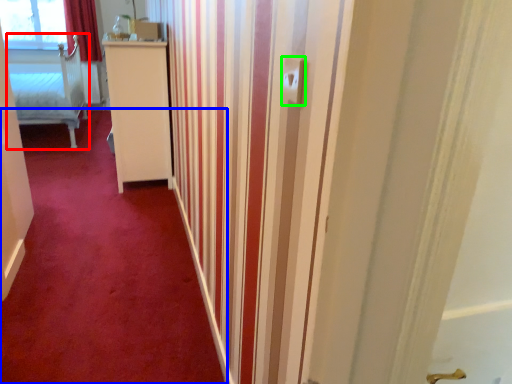
Question: Considering the real-world distances, which object is farthest from furniture (highlighted by a red box)? plain (highlighted by a blue box) or electric outlet (highlighted by a green box)?

Choices:
 (A) plain
 (B) electric outlet

Answer: (B)